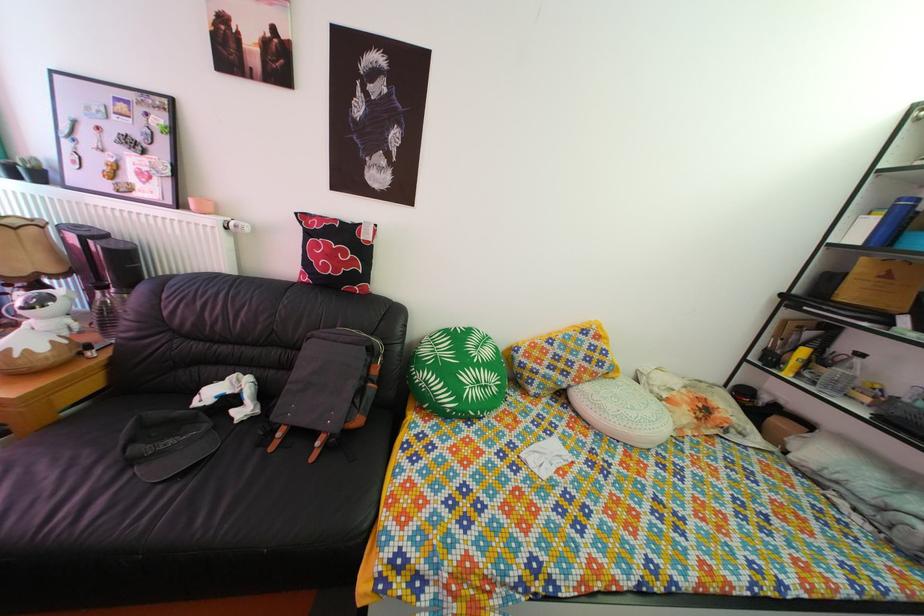
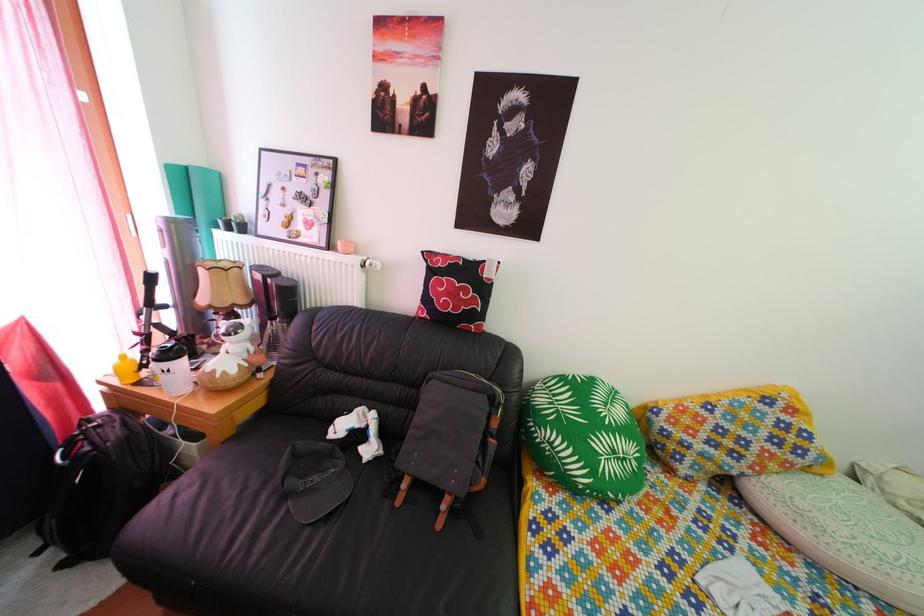
Question: What movement of the cameraman would produce the second image?

Choices:
 (A) Left
 (B) Right
 (C) Forward
 (D) Backward

Answer: (A)